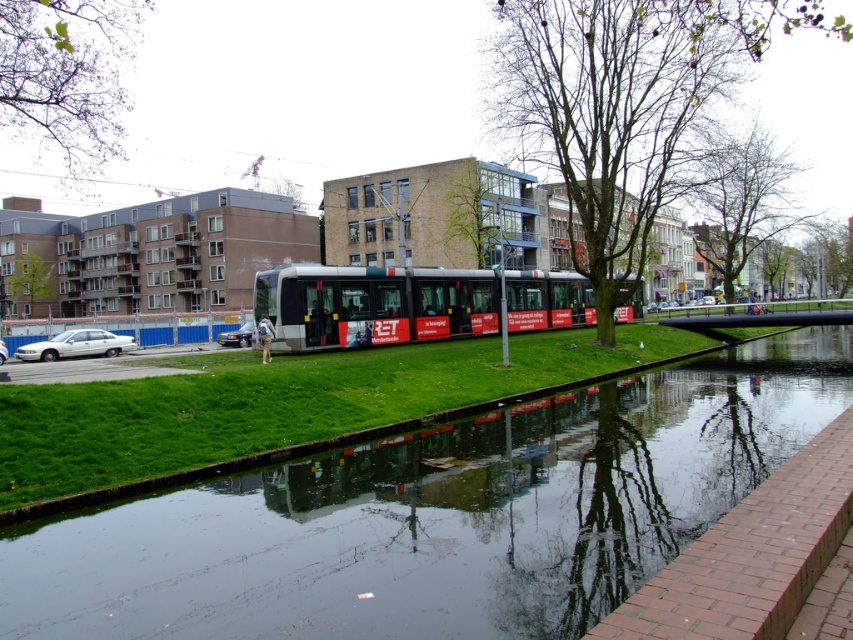
Does green grass at center have a greater width compared to silver metallic bus at center?

No.

Locate an element on the screen. green grass at center is located at coordinates [277, 403].